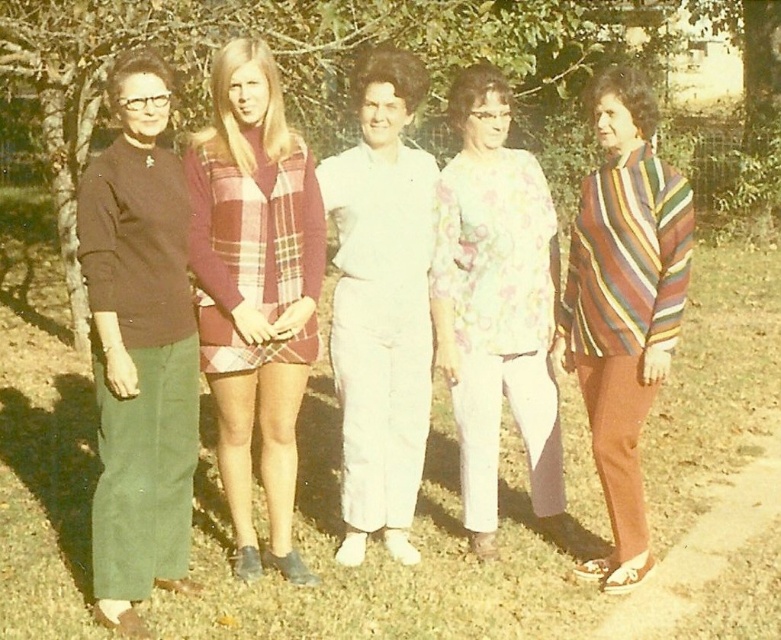
You are planning to take a photo of the green leafy tree at upper center and the striped sweater at right. Which object should you zoom in more on to ensure both are in focus, considering their sizes?

Since the green leafy tree at upper center is wider than the striped sweater at right, you should zoom in more on the green leafy tree at upper center to ensure both are in focus.

You are planning to take a photo of the group of women standing in the garden. The green leafy tree at upper center and the white cotton jumpsuit at center are both in your frame. Which object is taller in the image?

The green leafy tree at upper center is taller than the white cotton jumpsuit at center.